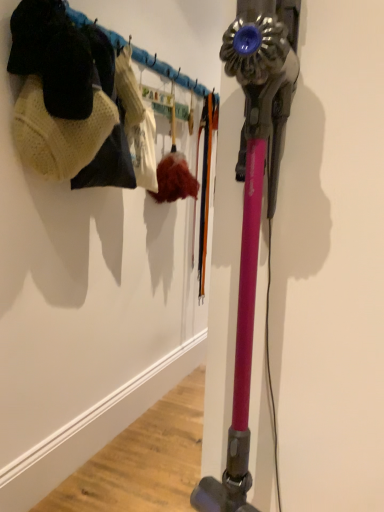
Where is `pink metallic vacuum at right`? The image size is (384, 512). pink metallic vacuum at right is located at coordinates (253, 203).

Describe the element at coordinates (253, 203) in the screenshot. The image size is (384, 512). I see `pink metallic vacuum at right` at that location.

What is the approximate width of knitted wool hat at upper left?

knitted wool hat at upper left is 9.76 inches wide.

At what (x,y) coordinates should I click in order to perform the action: click on knitted wool hat at upper left. Please return your answer as a coordinate pair (x, y). The width and height of the screenshot is (384, 512). Looking at the image, I should click on (114, 145).

This screenshot has width=384, height=512. Describe the element at coordinates (114, 145) in the screenshot. I see `knitted wool hat at upper left` at that location.

Find the location of a particular element. The height and width of the screenshot is (512, 384). pink metallic vacuum at right is located at coordinates (253, 203).

From the picture: Does pink metallic vacuum at right appear on the right side of knitted wool hat at upper left?

Yes.

Considering their positions, is pink metallic vacuum at right located in front of or behind knitted wool hat at upper left?

Clearly, pink metallic vacuum at right is in front of knitted wool hat at upper left.

Considering the points (265, 2) and (135, 114), which point is behind, point (265, 2) or point (135, 114)?

The point (135, 114) is farther.

From the image's perspective, is pink metallic vacuum at right above or below knitted wool hat at upper left?

Clearly, from the image's perspective, pink metallic vacuum at right is below knitted wool hat at upper left.

From a real-world perspective, is pink metallic vacuum at right on top of knitted wool hat at upper left?

Incorrect, from a real-world perspective, pink metallic vacuum at right is lower than knitted wool hat at upper left.

Considering the sizes of pink metallic vacuum at right and knitted wool hat at upper left in the image, is pink metallic vacuum at right wider or thinner than knitted wool hat at upper left?

Clearly, pink metallic vacuum at right has less width compared to knitted wool hat at upper left.

From the picture: Considering the relative sizes of pink metallic vacuum at right and knitted wool hat at upper left in the image provided, is pink metallic vacuum at right shorter than knitted wool hat at upper left?

No.

Between pink metallic vacuum at right and knitted wool hat at upper left, which one has larger size?

With larger size is pink metallic vacuum at right.

Can knitted wool hat at upper left be found inside pink metallic vacuum at right?

No, knitted wool hat at upper left is not surrounded by pink metallic vacuum at right.

Would you say pink metallic vacuum at right is a long distance from knitted wool hat at upper left?

No, pink metallic vacuum at right is not far from knitted wool hat at upper left.

Could you tell me if pink metallic vacuum at right is facing knitted wool hat at upper left?

No, pink metallic vacuum at right is not turned towards knitted wool hat at upper left.

How many degrees apart are the facing directions of pink metallic vacuum at right and knitted wool hat at upper left?

There is a 87.6-degree angle between the facing directions of pink metallic vacuum at right and knitted wool hat at upper left.

Locate an element on the screen. clothing behind the pink metallic vacuum at right is located at coordinates [114, 145].

Which is more to the left, knitted wool hat at upper left or pink metallic vacuum at right?

→ From the viewer's perspective, knitted wool hat at upper left appears more on the left side.

Looking at this image, is knitted wool hat at upper left positioned behind pink metallic vacuum at right?

Yes.

Between point (128, 99) and point (281, 4), which one is positioned behind?

Positioned behind is point (128, 99).

From the image's perspective, is knitted wool hat at upper left positioned above or below pink metallic vacuum at right?

knitted wool hat at upper left is above pink metallic vacuum at right.

From a real-world perspective, between knitted wool hat at upper left and pink metallic vacuum at right, who is vertically lower?

pink metallic vacuum at right is physically lower.

Between knitted wool hat at upper left and pink metallic vacuum at right, which one has smaller width?

With smaller width is pink metallic vacuum at right.

Considering the sizes of objects knitted wool hat at upper left and pink metallic vacuum at right in the image provided, who is shorter, knitted wool hat at upper left or pink metallic vacuum at right?

knitted wool hat at upper left is shorter.

Does knitted wool hat at upper left have a smaller size compared to pink metallic vacuum at right?

Yes.

Is knitted wool hat at upper left inside the boundaries of pink metallic vacuum at right, or outside?

knitted wool hat at upper left is located beyond the bounds of pink metallic vacuum at right.

Is knitted wool hat at upper left not close to pink metallic vacuum at right?

No, knitted wool hat at upper left is not far from pink metallic vacuum at right.

Does knitted wool hat at upper left turn towards pink metallic vacuum at right?

No, knitted wool hat at upper left is not turned towards pink metallic vacuum at right.

Locate an element on the screen. This screenshot has width=384, height=512. vacuum below the knitted wool hat at upper left (from the image's perspective) is located at coordinates (253, 203).

This screenshot has height=512, width=384. In order to click on clothing that is on the left side of pink metallic vacuum at right in this screenshot , I will do [114, 145].

Locate an element on the screen. This screenshot has width=384, height=512. vacuum in front of the knitted wool hat at upper left is located at coordinates (253, 203).